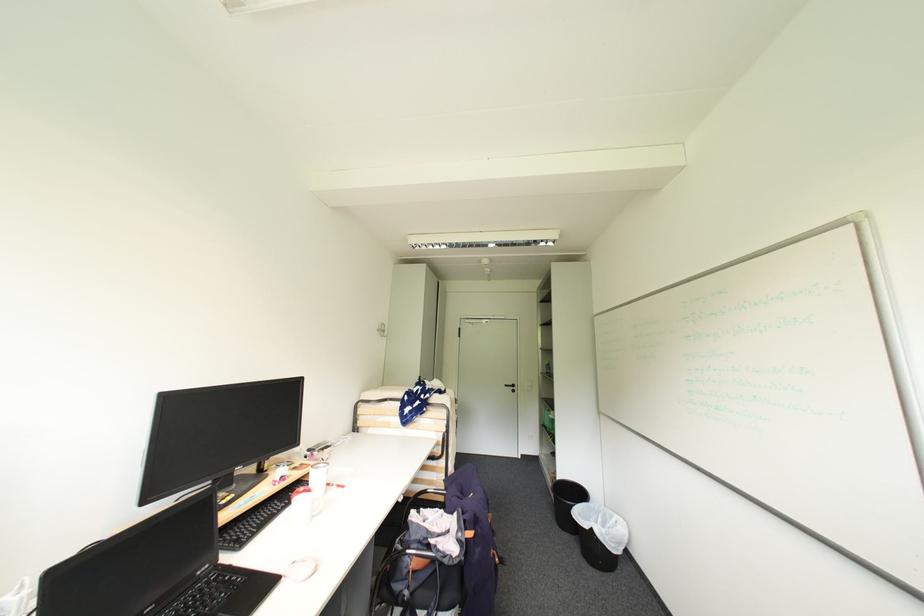
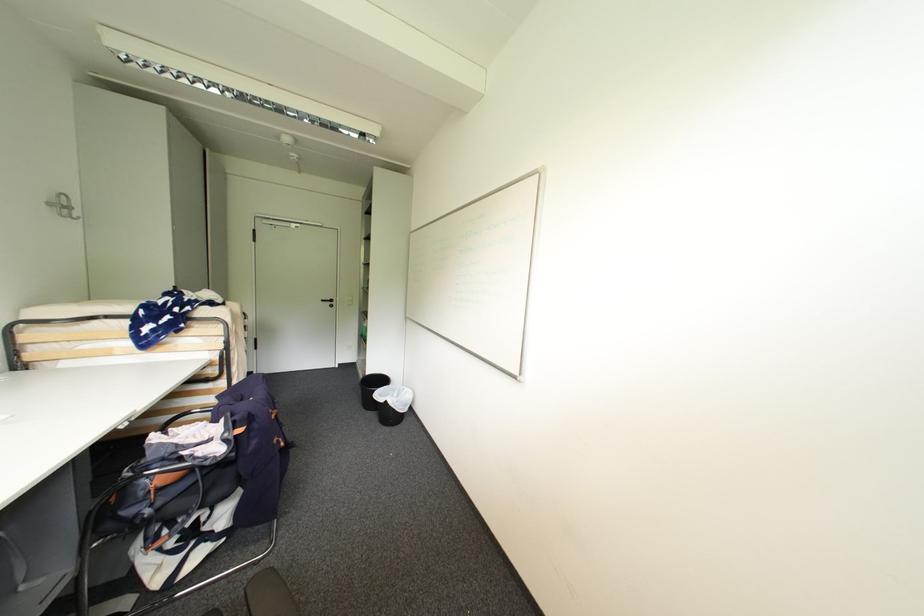
Question: The first image is from the beginning of the video and the second image is from the end. How did the camera likely rotate when shooting the video?

Choices:
 (A) Left
 (B) Right
 (C) Up
 (D) Down

Answer: (B)